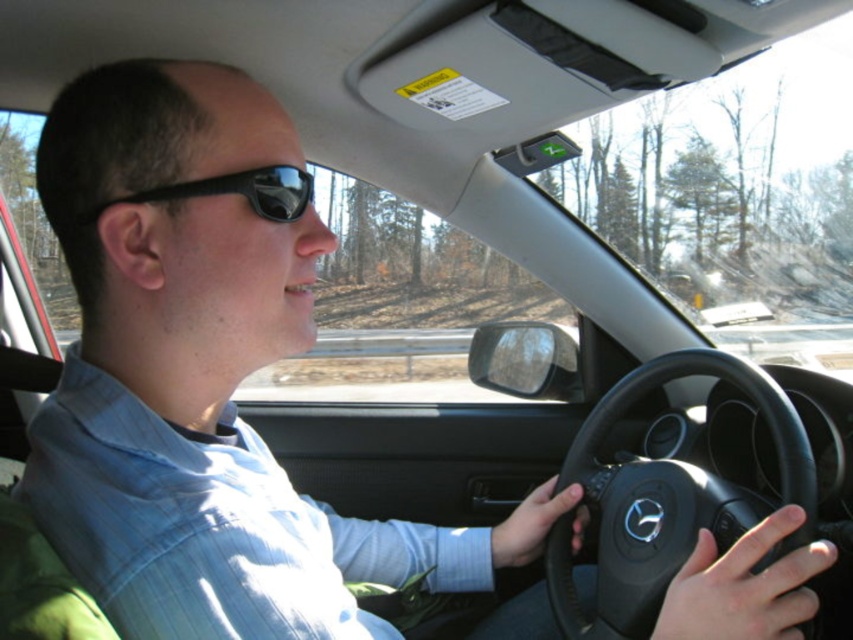
Between black leather steering wheel at center and black matte sunglasses at upper center, which one is positioned lower?

black leather steering wheel at center is below.

Can you confirm if black leather steering wheel at center is thinner than black matte sunglasses at upper center?

Incorrect, black leather steering wheel at center's width is not less than black matte sunglasses at upper center's.

Is point (798, 486) positioned after point (224, 192)?

Yes, point (798, 486) is farther from viewer.

You are a GUI agent. You are given a task and a screenshot of the screen. Output one action in this format:
    pyautogui.click(x=<x>, y=<y>)
    Task: Click on the black leather steering wheel at center
    The height and width of the screenshot is (640, 853).
    Given the screenshot: What is the action you would take?
    pyautogui.click(x=666, y=499)